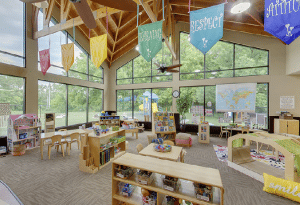
Image resolution: width=300 pixels, height=205 pixels. I want to click on class room, so click(x=133, y=149).